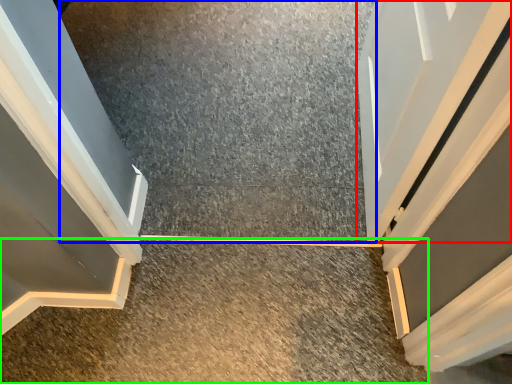
Question: Based on their relative distances, which object is farther from door (highlighted by a red box)? Choose from concrete (highlighted by a blue box) and concrete (highlighted by a green box).

Choices:
 (A) concrete
 (B) concrete

Answer: (B)